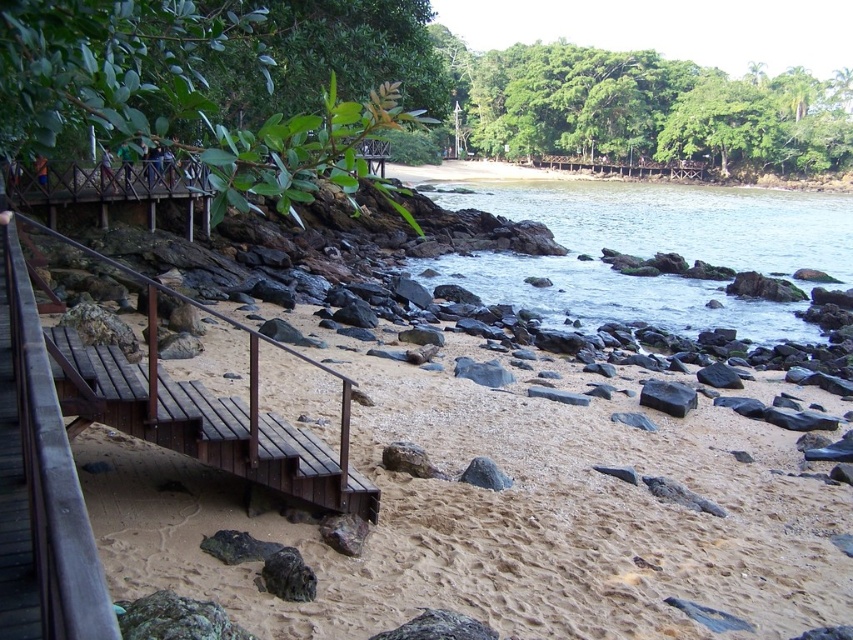
You are a visitor at the coastal reserve and want to take a photo of the black smooth rock at center and the clear water at center. Which object should you focus on first if you want to capture both in the same frame without moving the camera?

You should focus on the black smooth rock at center first because the clear water at center is positioned on the right side of it, so by centering the rock, the water will naturally be in the frame to its right.

You are a visitor at the coastal reserve and want to cross from the wooden walkway to the staircase. You notice the clear water at center and the brown wooden rail at left. Which one is wider in terms of their horizontal span?

The clear water at center is wider than the brown wooden rail at left, as its width surpasses the rail.